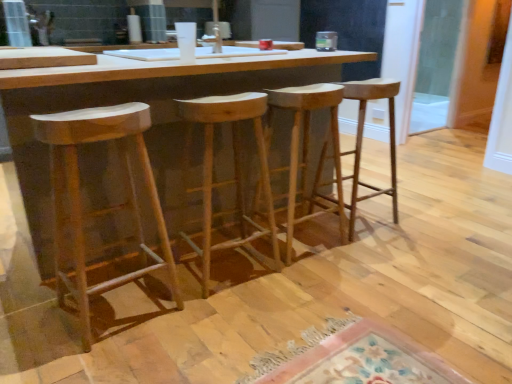
At what (x,y) coordinates should I click in order to perform the action: click on vacant area that is in front of natural wood stool at center, the 2th stool when ordered from right to left. Please return your answer as a coordinate pair (x, y). The image size is (512, 384). Looking at the image, I should click on (315, 278).